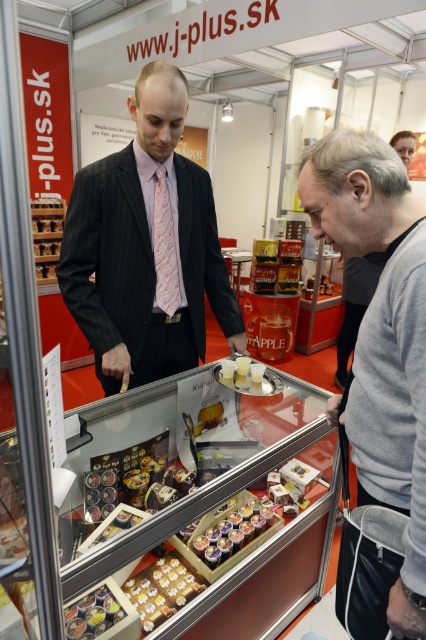
Question: Is gray cotton sweater at lower right bigger than metallic silver tray at lower left?

Choices:
 (A) no
 (B) yes

Answer: (B)

Question: Can you confirm if gray cotton sweater at lower right is smaller than shiny chocolate bar at center?

Choices:
 (A) yes
 (B) no

Answer: (B)

Question: Considering the real-world distances, which object is closest to the dark pinstripe suit at center?

Choices:
 (A) shiny chocolate bar at center
 (B) smooth skin face at upper right

Answer: (A)

Question: From the image, what is the correct spatial relationship of shiny metallic canisters at center in relation to pink striped tie at center?

Choices:
 (A) left
 (B) right

Answer: (B)

Question: Estimate the real-world distances between objects in this image. Which object is closer to the shiny chocolate bar at center?

Choices:
 (A) shiny metallic canisters at center
 (B) pink striped tie at center
 (C) smooth skin face at upper right
 (D) metallic silver tray at lower left

Answer: (A)

Question: Among these objects, which one is nearest to the camera?

Choices:
 (A) shiny chocolate bar at center
 (B) smooth skin face at upper right

Answer: (A)